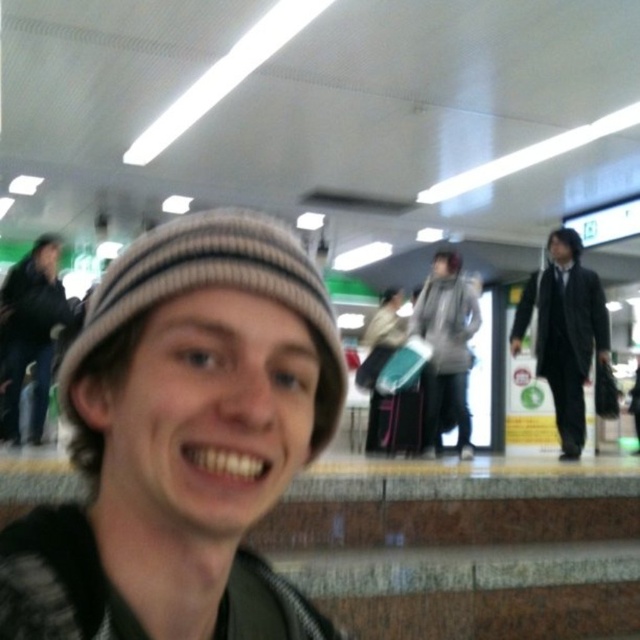
You are standing in a train station and see the point marked as point (29, 332). What object is located at that point?

The dark gray knit hat at left is located at point (29, 332).

You are a fashion designer observing the two scarves in the image. Which one is smaller between the gray wool scarf at center and the knitted beige scarf at center?

The gray wool scarf at center is smaller than the knitted beige scarf at center.

You are a photographer trying to capture the scene. You notice two hats in the image, the knit cap at center and the dark gray knit hat at left. Which hat is positioned more to the right side of the image?

The knit cap at center is positioned more to the right side of the image compared to the dark gray knit hat at left.